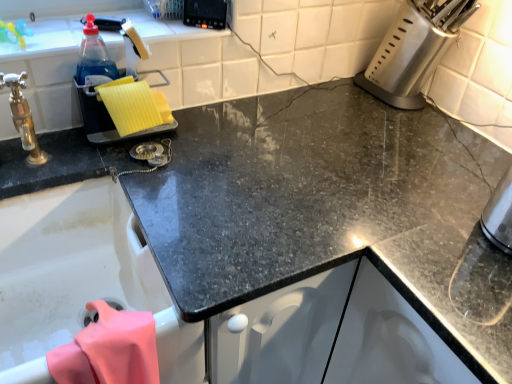
This screenshot has height=384, width=512. Describe the element at coordinates (121, 97) in the screenshot. I see `yellow sponge at left, marked as the third appliance in a right-to-left arrangement` at that location.

Image resolution: width=512 pixels, height=384 pixels. What do you see at coordinates (109, 350) in the screenshot?
I see `pink fabric at lower left` at bounding box center [109, 350].

Identify the location of black plastic control panel at upper center, placed as the 2th appliance when sorted from left to right. The width and height of the screenshot is (512, 384). 205,13.

In the scene shown: Considering their positions, is black plastic control panel at upper center, placed as the 2th appliance when sorted from left to right, located in front of or behind yellow sponge at left, which is the 1th appliance in left-to-right order?

black plastic control panel at upper center, placed as the 2th appliance when sorted from left to right, is positioned farther from the viewer than yellow sponge at left, which is the 1th appliance in left-to-right order.

From the image's perspective, is black plastic control panel at upper center, the second appliance positioned from the right, located above or below yellow sponge at left, marked as the third appliance in a right-to-left arrangement?

Based on their image positions, black plastic control panel at upper center, the second appliance positioned from the right, is located above yellow sponge at left, marked as the third appliance in a right-to-left arrangement.

How different are the orientations of black plastic control panel at upper center, placed as the 2th appliance when sorted from left to right, and yellow sponge at left, marked as the third appliance in a right-to-left arrangement, in degrees?

They differ by 21.3 degrees in their facing directions.

From a real-world perspective, is black plastic control panel at upper center, placed as the 2th appliance when sorted from left to right, on yellow sponge at left, marked as the third appliance in a right-to-left arrangement?

Yes, from a real-world perspective, black plastic control panel at upper center, placed as the 2th appliance when sorted from left to right, is on top of yellow sponge at left, marked as the third appliance in a right-to-left arrangement.

Based on the photo, is there a large distance between satin silver knife block at upper right, the 1th appliance when ordered from right to left, and yellow sponge at left, which is the 1th appliance in left-to-right order?

No, satin silver knife block at upper right, the 1th appliance when ordered from right to left, is in close proximity to yellow sponge at left, which is the 1th appliance in left-to-right order.

Considering the positions of points (400, 72) and (169, 118), is point (400, 72) farther from camera compared to point (169, 118)?

Yes.

In the scene shown: Is satin silver knife block at upper right, the 1th appliance when ordered from right to left, situated inside yellow sponge at left, marked as the third appliance in a right-to-left arrangement, or outside?

satin silver knife block at upper right, the 1th appliance when ordered from right to left, is not inside yellow sponge at left, marked as the third appliance in a right-to-left arrangement, it's outside.

From the pink fabric at lower left, count 1st appliance to the right and point to it. Please provide its 2D coordinates.

[(205, 13)]

Which of these two, pink fabric at lower left or black plastic control panel at upper center, placed as the 2th appliance when sorted from left to right, is wider?

With larger width is pink fabric at lower left.

Measure the distance between pink fabric at lower left and black plastic control panel at upper center, placed as the 2th appliance when sorted from left to right.

pink fabric at lower left and black plastic control panel at upper center, placed as the 2th appliance when sorted from left to right, are 30.13 inches apart.

Consider the image. Is pink fabric at lower left surrounding black plastic control panel at upper center, placed as the 2th appliance when sorted from left to right?

No, pink fabric at lower left does not contain black plastic control panel at upper center, placed as the 2th appliance when sorted from left to right.

Which of these two, satin silver knife block at upper right, the 1th appliance when ordered from right to left, or pink fabric at lower left, is bigger?

Bigger between the two is satin silver knife block at upper right, the 1th appliance when ordered from right to left.

How many degrees apart are the facing directions of satin silver knife block at upper right, which appears as the 3th appliance when viewed from the left, and pink fabric at lower left?

The angular difference between satin silver knife block at upper right, which appears as the 3th appliance when viewed from the left, and pink fabric at lower left is 0.709 degrees.

Considering the sizes of satin silver knife block at upper right, the 1th appliance when ordered from right to left, and pink fabric at lower left in the image, is satin silver knife block at upper right, the 1th appliance when ordered from right to left, wider or thinner than pink fabric at lower left?

satin silver knife block at upper right, the 1th appliance when ordered from right to left, is wider than pink fabric at lower left.

Which object is closer to the camera taking this photo, satin silver knife block at upper right, which appears as the 3th appliance when viewed from the left, or pink fabric at lower left?

pink fabric at lower left is closer to the camera.

From the picture: Relative to satin silver knife block at upper right, the 1th appliance when ordered from right to left, is black plastic control panel at upper center, the second appliance positioned from the right, in front or behind?

In the image, black plastic control panel at upper center, the second appliance positioned from the right, appears behind satin silver knife block at upper right, the 1th appliance when ordered from right to left.

Where is `appliance that is the 1st object located in front of the black plastic control panel at upper center, the second appliance positioned from the right`? This screenshot has width=512, height=384. appliance that is the 1st object located in front of the black plastic control panel at upper center, the second appliance positioned from the right is located at coordinates (414, 50).

Consider the image. Is black plastic control panel at upper center, the second appliance positioned from the right, positioned far away from satin silver knife block at upper right, which appears as the 3th appliance when viewed from the left?

No.

Which point is more distant from viewer, (187, 6) or (398, 44)?

The point (398, 44) is farther from the camera.

Based on the photo, relative to black plastic control panel at upper center, placed as the 2th appliance when sorted from left to right, is satin silver knife block at upper right, the 1th appliance when ordered from right to left, in front or behind?

In the image, satin silver knife block at upper right, the 1th appliance when ordered from right to left, appears in front of black plastic control panel at upper center, placed as the 2th appliance when sorted from left to right.

Considering the points (450, 45) and (188, 3), which point is behind, point (450, 45) or point (188, 3)?

The point (450, 45) is farther.

Does point (127, 108) lie in front of point (99, 303)?

No.

Is yellow sponge at left, marked as the third appliance in a right-to-left arrangement, not near pink fabric at lower left?

They are positioned close to each other.

Is yellow sponge at left, marked as the third appliance in a right-to-left arrangement, oriented away from pink fabric at lower left?

yellow sponge at left, marked as the third appliance in a right-to-left arrangement, is not turned away from pink fabric at lower left.

From the image's perspective, is yellow sponge at left, which is the 1th appliance in left-to-right order, on top of pink fabric at lower left?

Indeed, from the image's perspective, yellow sponge at left, which is the 1th appliance in left-to-right order, is shown above pink fabric at lower left.

From a real-world perspective, count 2nd appliances downward from the black plastic control panel at upper center, placed as the 2th appliance when sorted from left to right, and point to it. Please provide its 2D coordinates.

[(121, 97)]

Which appliance is the 1st one when counting from the back of the yellow sponge at left, marked as the third appliance in a right-to-left arrangement? Please provide its 2D coordinates.

[(414, 50)]

Which object lies nearer to the anchor point pink fabric at lower left, yellow sponge at left, which is the 1th appliance in left-to-right order, or black plastic control panel at upper center, the second appliance positioned from the right?

yellow sponge at left, which is the 1th appliance in left-to-right order, is positioned closer to the anchor pink fabric at lower left.

Based on their spatial positions, is pink fabric at lower left or black plastic control panel at upper center, the second appliance positioned from the right, closer to satin silver knife block at upper right, the 1th appliance when ordered from right to left?

black plastic control panel at upper center, the second appliance positioned from the right.

When comparing their distances from pink fabric at lower left, does black plastic control panel at upper center, the second appliance positioned from the right, or yellow sponge at left, marked as the third appliance in a right-to-left arrangement, seem further?

The object further to pink fabric at lower left is black plastic control panel at upper center, the second appliance positioned from the right.

When comparing their distances from satin silver knife block at upper right, the 1th appliance when ordered from right to left, does yellow sponge at left, marked as the third appliance in a right-to-left arrangement, or pink fabric at lower left seem closer?

Among the two, yellow sponge at left, marked as the third appliance in a right-to-left arrangement, is located nearer to satin silver knife block at upper right, the 1th appliance when ordered from right to left.

In the scene shown: Which object lies nearer to the anchor point pink fabric at lower left, black plastic control panel at upper center, the second appliance positioned from the right, or satin silver knife block at upper right, the 1th appliance when ordered from right to left?

Among the two, black plastic control panel at upper center, the second appliance positioned from the right, is located nearer to pink fabric at lower left.

When comparing their distances from satin silver knife block at upper right, which appears as the 3th appliance when viewed from the left, does black plastic control panel at upper center, placed as the 2th appliance when sorted from left to right, or pink fabric at lower left seem closer?

black plastic control panel at upper center, placed as the 2th appliance when sorted from left to right, is closer to satin silver knife block at upper right, which appears as the 3th appliance when viewed from the left.

Estimate the real-world distances between objects in this image. Which object is closer to black plastic control panel at upper center, placed as the 2th appliance when sorted from left to right, pink fabric at lower left or yellow sponge at left, marked as the third appliance in a right-to-left arrangement?

Among the two, yellow sponge at left, marked as the third appliance in a right-to-left arrangement, is located nearer to black plastic control panel at upper center, placed as the 2th appliance when sorted from left to right.

Looking at this image, which object lies further to the anchor point black plastic control panel at upper center, the second appliance positioned from the right, satin silver knife block at upper right, the 1th appliance when ordered from right to left, or yellow sponge at left, marked as the third appliance in a right-to-left arrangement?

satin silver knife block at upper right, the 1th appliance when ordered from right to left, is positioned further to the anchor black plastic control panel at upper center, the second appliance positioned from the right.

At what (x,y) coordinates should I click in order to perform the action: click on appliance situated between yellow sponge at left, marked as the third appliance in a right-to-left arrangement, and satin silver knife block at upper right, which appears as the 3th appliance when viewed from the left, from left to right. Please return your answer as a coordinate pair (x, y). This screenshot has width=512, height=384. Looking at the image, I should click on (205, 13).

The width and height of the screenshot is (512, 384). What are the coordinates of `clothe located between yellow sponge at left, marked as the third appliance in a right-to-left arrangement, and satin silver knife block at upper right, the 1th appliance when ordered from right to left, in the left-right direction` in the screenshot? It's located at (109, 350).